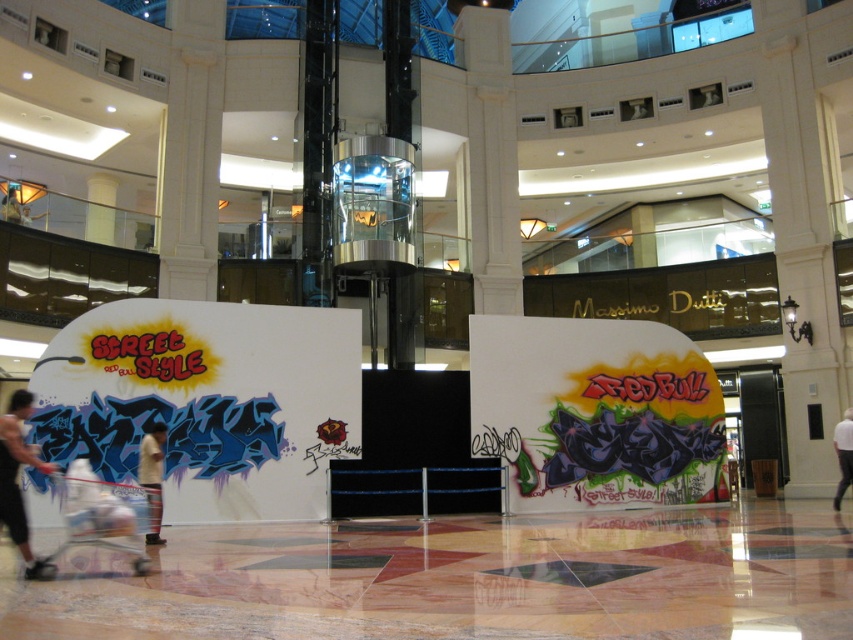
Question: Observing the image, what is the correct spatial positioning of white plastic baby carriage at lower left in reference to white fabric at center?

Choices:
 (A) below
 (B) above

Answer: (B)

Question: Which object appears closest to the camera in this image?

Choices:
 (A) white plastic baby carriage at lower left
 (B) skinny jeans at lower left
 (C) tan cotton shirt at center
 (D) white fabric at center

Answer: (B)

Question: Can you confirm if white plastic baby carriage at lower left is wider than tan cotton shirt at center?

Choices:
 (A) yes
 (B) no

Answer: (A)

Question: Which of the following is the closest to the observer?

Choices:
 (A) (76, 481)
 (B) (149, 444)
 (C) (840, 461)

Answer: (A)

Question: Which object is positioned farthest from the white fabric at center?

Choices:
 (A) tan cotton shirt at center
 (B) white plastic baby carriage at lower left

Answer: (A)

Question: Is white plastic baby carriage at lower left bigger than white fabric at center?

Choices:
 (A) yes
 (B) no

Answer: (B)